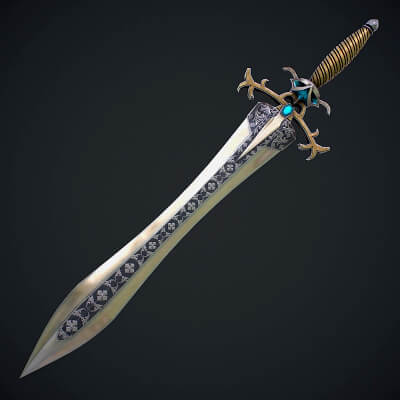
At what (x,y) coordinates should I click in order to perform the action: click on ornamentation. Please return your answer as a coordinate pair (x, y). Image resolution: width=400 pixels, height=400 pixels. Looking at the image, I should click on (171, 224), (260, 111), (282, 133).